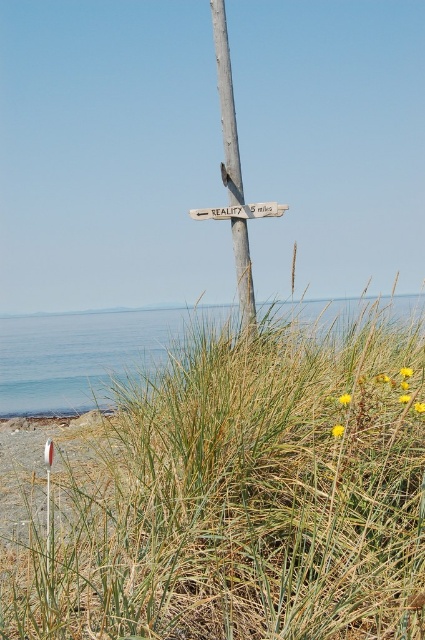
From the picture: You are standing at the center of the scene and want to place a 15 feet long wooden plank between the green grassy at center and the white plastic sign at center. Will the plank reach both objects?

The green grassy at center and white plastic sign at center are 14.86 feet apart from each other. Since the plank is 15 feet long, it will reach both objects with a little extra length remaining.

You are a hiker who needs to read both the wooden signpost at center and the white plastic sign at center. Which one will be easier to read from a distance?

The wooden signpost at center is larger in size than the white plastic sign at center, so it will be easier to read from a distance.